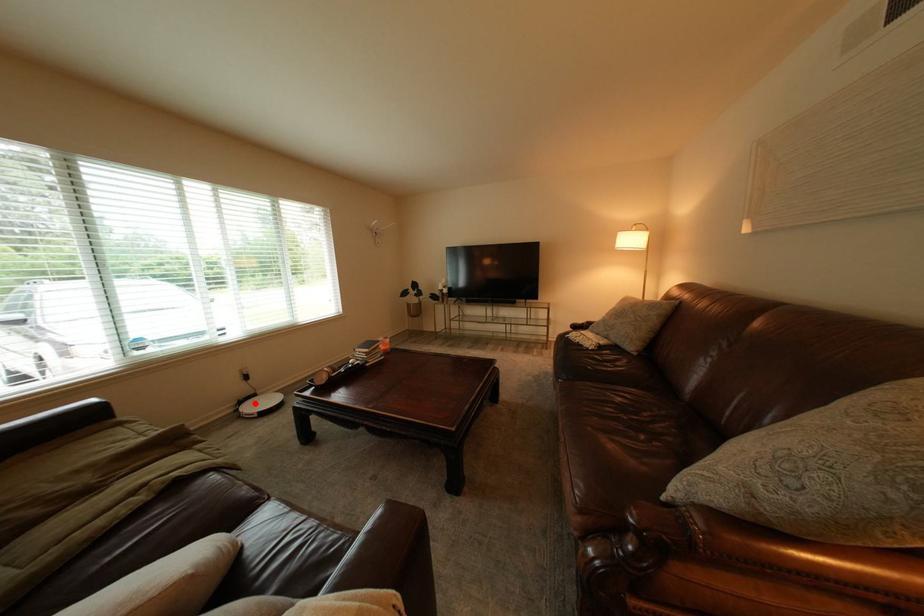
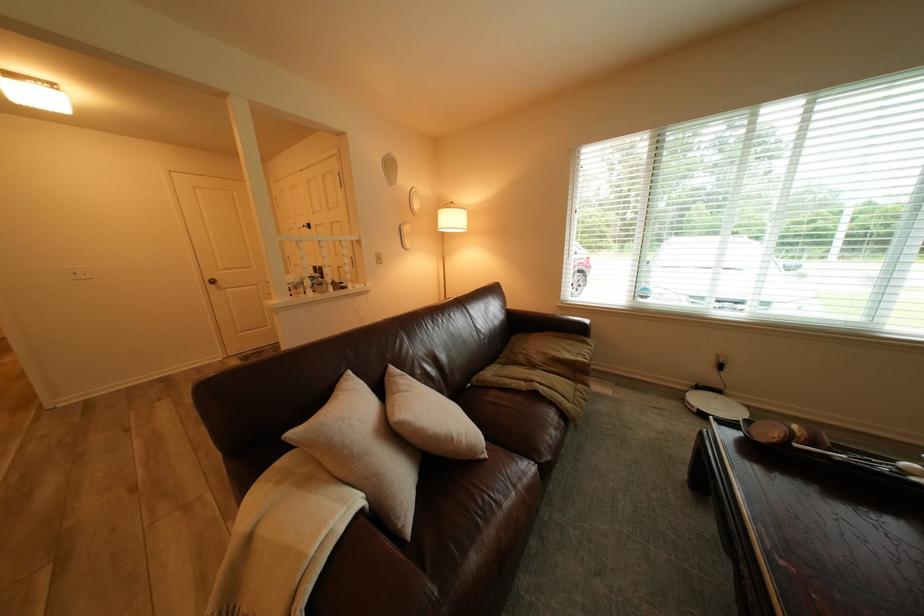
Question: I am providing you with two images of the same scene from different viewpoints. Given a red point in image1, look at the same physical point in image2. Is it:

Choices:
 (A) Closer to the viewpoint
 (B) Farther from the viewpoint

Answer: (A)